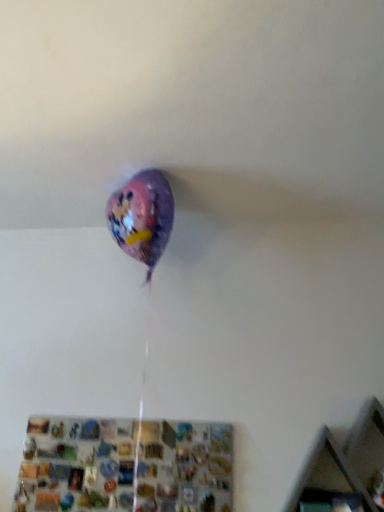
Question: In which direction should I rotate to look at metallic mosaic shelf at lower center, which is the 1th shelf in left-to-right order?

Choices:
 (A) left
 (B) right

Answer: (A)

Question: Does wooden at upper right, arranged as the 1th shelf when viewed from the right, have a smaller size compared to metallic mosaic shelf at lower center, which appears as the 2th shelf when viewed from the right?

Choices:
 (A) no
 (B) yes

Answer: (A)

Question: Can you confirm if wooden at upper right, arranged as the 1th shelf when viewed from the right, is bigger than metallic mosaic shelf at lower center, which appears as the 2th shelf when viewed from the right?

Choices:
 (A) yes
 (B) no

Answer: (A)

Question: Is wooden at upper right, arranged as the 1th shelf when viewed from the right, shorter than metallic mosaic shelf at lower center, which is the 1th shelf in left-to-right order?

Choices:
 (A) no
 (B) yes

Answer: (A)

Question: From the image's perspective, is wooden at upper right, arranged as the 1th shelf when viewed from the right, under metallic mosaic shelf at lower center, which is the 1th shelf in left-to-right order?

Choices:
 (A) yes
 (B) no

Answer: (B)

Question: Does wooden at upper right, arranged as the 1th shelf when viewed from the right, turn towards metallic mosaic shelf at lower center, which appears as the 2th shelf when viewed from the right?

Choices:
 (A) yes
 (B) no

Answer: (B)

Question: Does wooden at upper right, arranged as the 1th shelf when viewed from the right, appear on the right side of metallic mosaic shelf at lower center, which appears as the 2th shelf when viewed from the right?

Choices:
 (A) yes
 (B) no

Answer: (A)

Question: From a real-world perspective, is metallic mosaic shelf at lower center, which is the 1th shelf in left-to-right order, on wooden at upper right, arranged as the 1th shelf when viewed from the right?

Choices:
 (A) no
 (B) yes

Answer: (A)

Question: Does metallic mosaic shelf at lower center, which is the 1th shelf in left-to-right order, have a lesser height compared to wooden at upper right, which is counted as the 2th shelf, starting from the left?

Choices:
 (A) no
 (B) yes

Answer: (B)

Question: From the image's perspective, is metallic mosaic shelf at lower center, which is the 1th shelf in left-to-right order, on top of wooden at upper right, which is counted as the 2th shelf, starting from the left?

Choices:
 (A) no
 (B) yes

Answer: (A)

Question: Is wooden at upper right, arranged as the 1th shelf when viewed from the right, completely or partially inside metallic mosaic shelf at lower center, which appears as the 2th shelf when viewed from the right?

Choices:
 (A) yes
 (B) no

Answer: (B)

Question: Is metallic mosaic shelf at lower center, which is the 1th shelf in left-to-right order, at the left side of wooden at upper right, arranged as the 1th shelf when viewed from the right?

Choices:
 (A) no
 (B) yes

Answer: (B)

Question: Is metallic mosaic shelf at lower center, which is the 1th shelf in left-to-right order, oriented away from wooden at upper right, which is counted as the 2th shelf, starting from the left?

Choices:
 (A) yes
 (B) no

Answer: (B)

Question: Is metallic mosaic shelf at lower center, which is the 1th shelf in left-to-right order, in front of or behind wooden at upper right, which is counted as the 2th shelf, starting from the left, in the image?

Choices:
 (A) front
 (B) behind

Answer: (B)